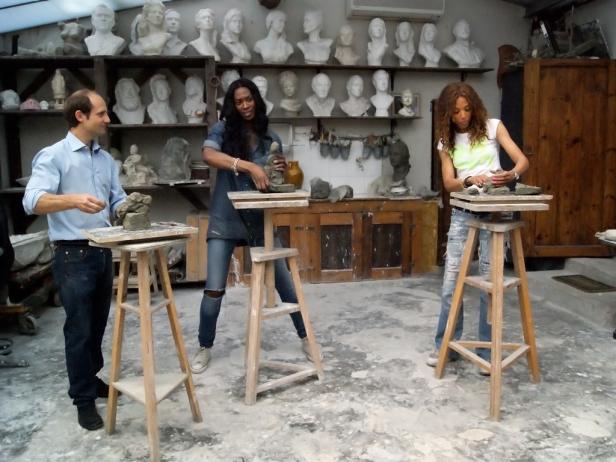
At what (x,y) coordinates should I click in order to perform the action: click on floor. Please return your answer as a coordinate pair (x, y). Looking at the image, I should click on (362, 393).